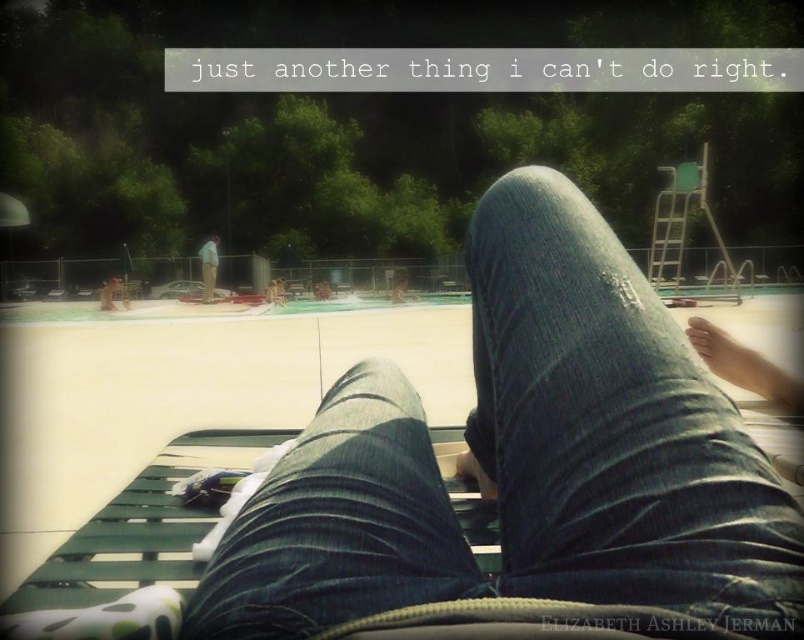
You are a photographer trying to capture the smooth skin foot at lower right and the smooth tan skin at center in a single shot. Which object should you focus on first to ensure both are in frame?

The smooth skin foot at lower right is in front of the smooth tan skin at center, so you should focus on the smooth tan skin at center first to ensure both are in frame.

You are a lifeguard standing at the edge of the pool. You notice two items at the center of the pool deck. The denim jeans at center and the light green fabric at center. Which item is positioned lower in the scene?

The denim jeans at center is below light green fabric at center, so the denim jeans at center is positioned lower in the scene.

You are standing at the edge of the pool and want to take a photo of both the point at coordinates (x=725, y=346) and the point at coordinates (x=398, y=275). Based on their positions, which point will appear larger in your photo?

Point at coordinates (x=725, y=346) will appear larger in the photo because it is closer to the camera than point at coordinates (x=398, y=275).